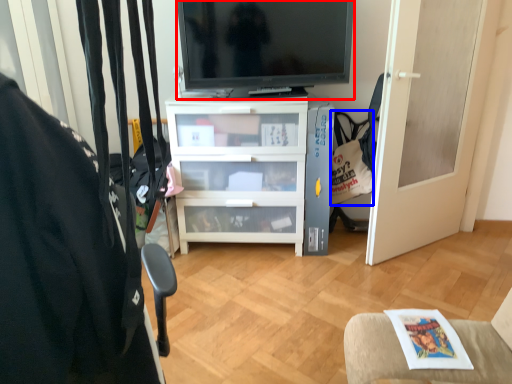
Question: Which of the following is the closest to the observer, television (highlighted by a red box) or handbag (highlighted by a blue box)?

Choices:
 (A) television
 (B) handbag

Answer: (A)